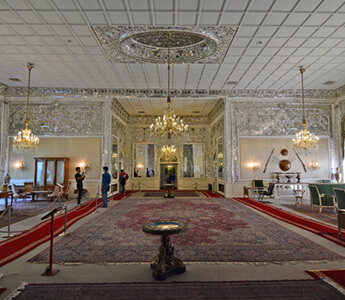
Locate an element on the screen. The width and height of the screenshot is (345, 300). beige rectangular part of wall bordered with white is located at coordinates (262, 145), (87, 144), (238, 141), (103, 140).